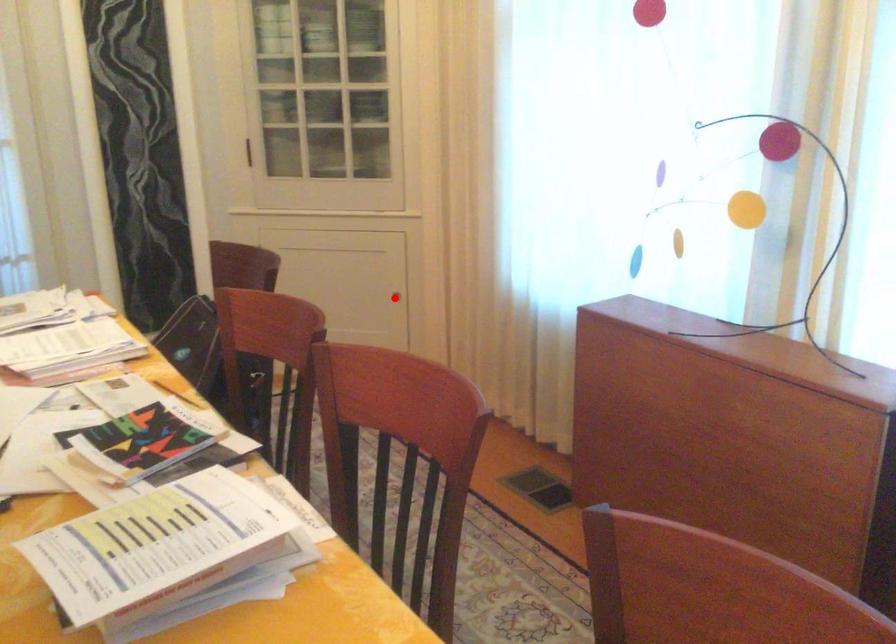
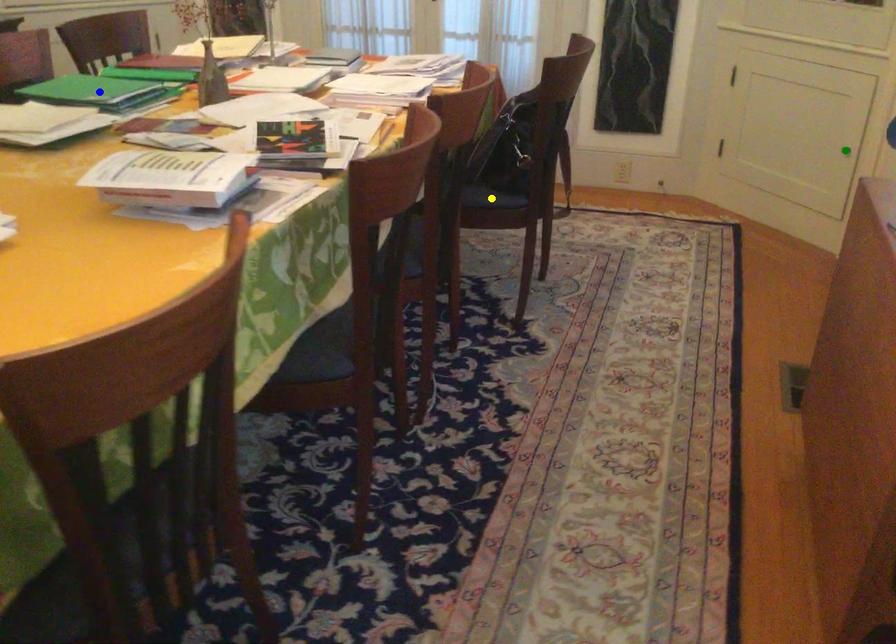
Question: I am providing you with two images of the same scene from different viewpoints. A red point is marked on the first image. You are given multiple points on the second image. Which point in image 2 represents the same 3d spot as the red point in image 1?

Choices:
 (A) green point
 (B) blue point
 (C) yellow point

Answer: (A)